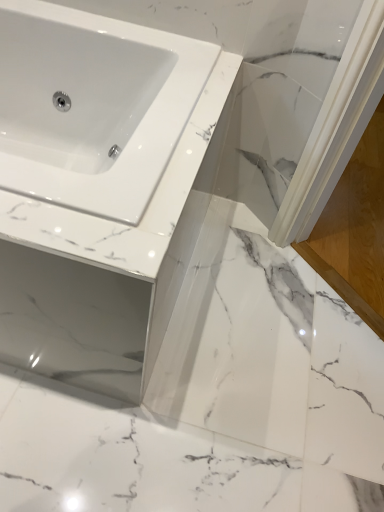
Question: In terms of size, does white marble screen door at lower right appear bigger or smaller than white marble countertop at center?

Choices:
 (A) big
 (B) small

Answer: (B)

Question: Considering the positions of white marble screen door at lower right and white marble countertop at center in the image, is white marble screen door at lower right taller or shorter than white marble countertop at center?

Choices:
 (A) short
 (B) tall

Answer: (A)

Question: Does point (327, 276) appear closer or farther from the camera than point (13, 198)?

Choices:
 (A) farther
 (B) closer

Answer: (A)

Question: From the image's perspective, relative to white marble screen door at lower right, is white marble countertop at center above or below?

Choices:
 (A) above
 (B) below

Answer: (B)

Question: Considering the positions of point (57, 378) and point (372, 131), is point (57, 378) closer or farther from the camera than point (372, 131)?

Choices:
 (A) farther
 (B) closer

Answer: (B)

Question: Looking at the image, does white marble countertop at center seem bigger or smaller compared to white marble screen door at lower right?

Choices:
 (A) big
 (B) small

Answer: (A)

Question: From their relative heights in the image, would you say white marble countertop at center is taller or shorter than white marble screen door at lower right?

Choices:
 (A) tall
 (B) short

Answer: (A)